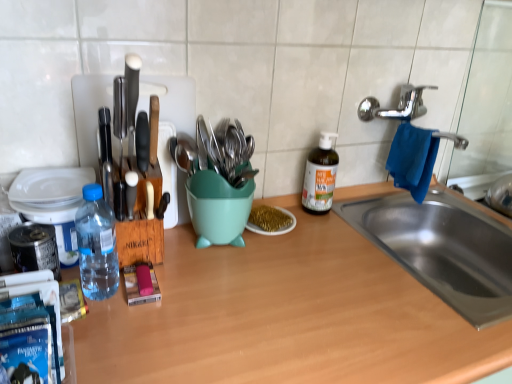
The image size is (512, 384). I want to click on free location to the right of transparent plastic bottle at left, placed as the second bottle when sorted from back to front, so click(192, 306).